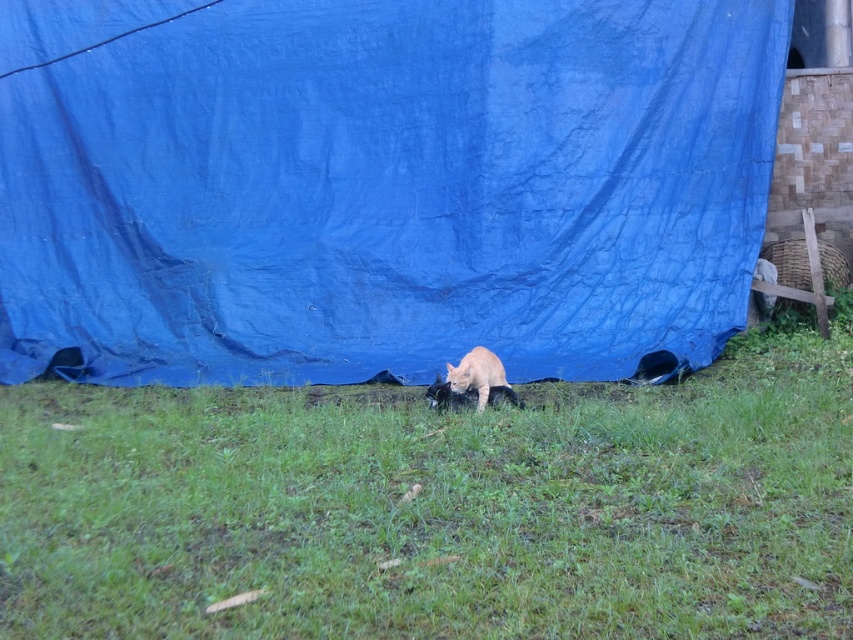
You are standing at the origin point in the image. There are two points marked in the scene. Which point is closer to you, point (431, 337) or point (508, 387)?

Point (508, 387) is closer to you because it is in front of point (431, 337).

You are a photographer trying to capture a closeup of the orange fur cat at center. Since the green grass at center is in the way, can you move the grass to the side to get a clear shot?

The green grass at center is wider than the orange fur cat at center, so moving it might be necessary to get a clear shot.

You are standing at the point with coordinates (x=379, y=184) in the image. What object are you directly facing?

The point at coordinates (x=379, y=184) is directly facing the blue tarpaulin at center.